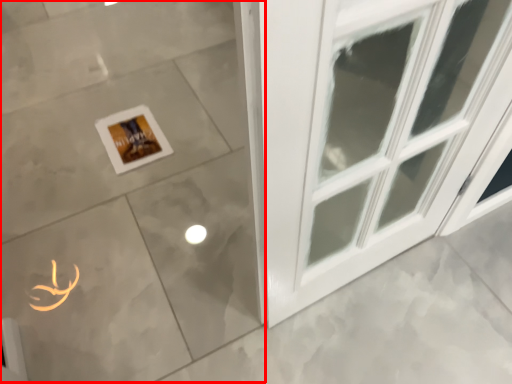
Question: In this image, where is ceramic tile (annotated by the red box) located relative to picture frame?

Choices:
 (A) right
 (B) left

Answer: (A)